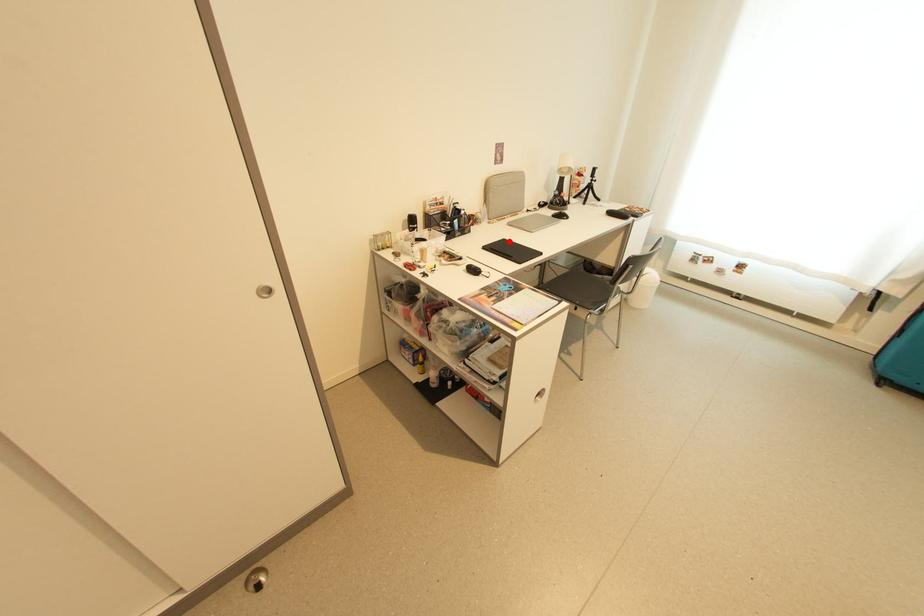
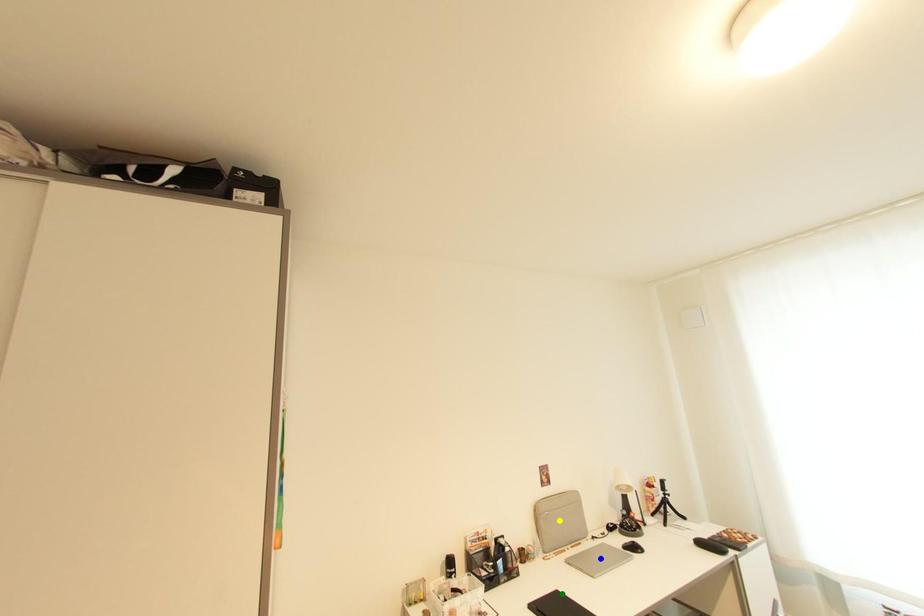
Question: I am providing you with two images of the same scene from different viewpoints. A red point is marked on the first image. You are given multiple points on the second image. In image 2, which mark is for the same physical point as the one in image 1?

Choices:
 (A) green point
 (B) blue point
 (C) yellow point

Answer: (A)